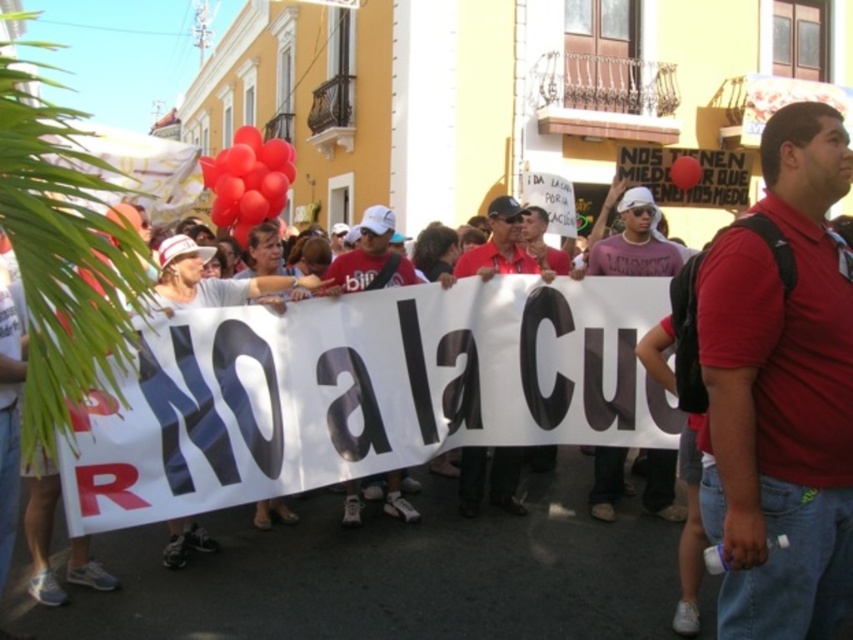
Question: Can you confirm if red cotton shirt at center is wider than white matte cap at center?

Choices:
 (A) yes
 (B) no

Answer: (B)

Question: Which object appears farthest from the camera in this image?

Choices:
 (A) red shirt at center
 (B) red cotton shirt at center

Answer: (A)

Question: Is red shirt at center positioned before rubber balloon at center?

Choices:
 (A) no
 (B) yes

Answer: (B)

Question: Estimate the real-world distances between objects in this image. Which object is closer to the matte red shirt at center?

Choices:
 (A) rubber balloon at center
 (B) rubber heart balloons at upper center
 (C) red shirt at center

Answer: (C)

Question: Is rubber heart balloons at upper center to the left of matte red shirt at center from the viewer's perspective?

Choices:
 (A) no
 (B) yes

Answer: (B)

Question: Which point appears farthest from the camera in this image?

Choices:
 (A) (355, 516)
 (B) (515, 272)

Answer: (B)